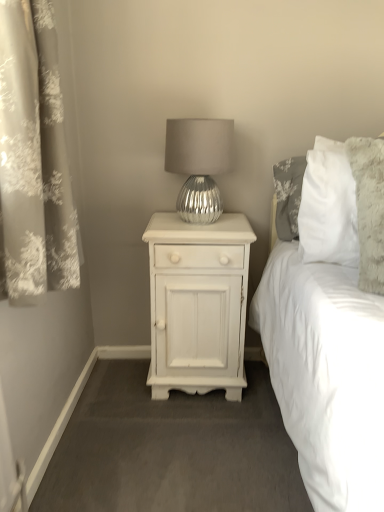
You are a GUI agent. You are given a task and a screenshot of the screen. Output one action in this format:
    pyautogui.click(x=<x>, y=<y>)
    Task: Click on the vacant space underneath silvery floral curtain at left (from a real-world perspective)
    The image size is (384, 512).
    Given the screenshot: What is the action you would take?
    pyautogui.click(x=66, y=477)